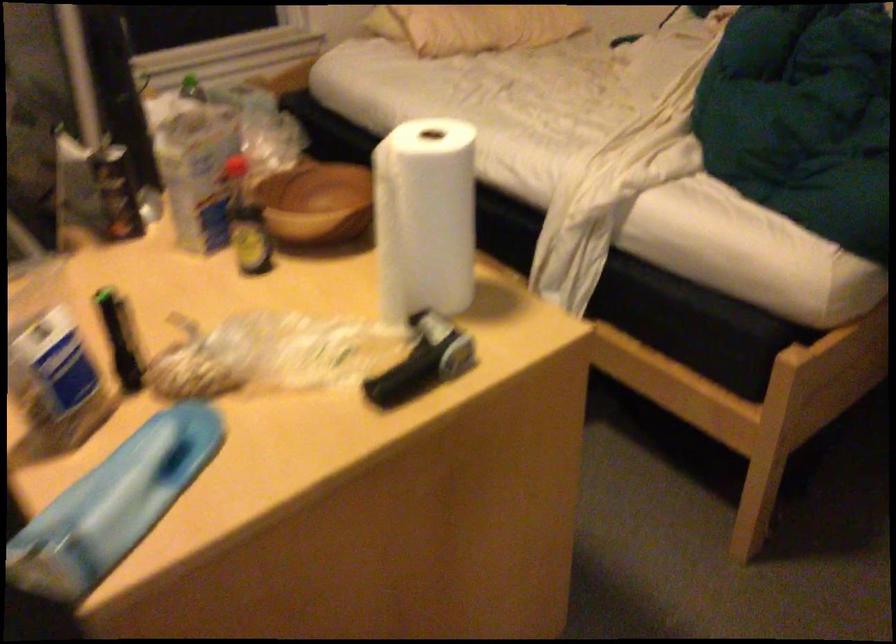
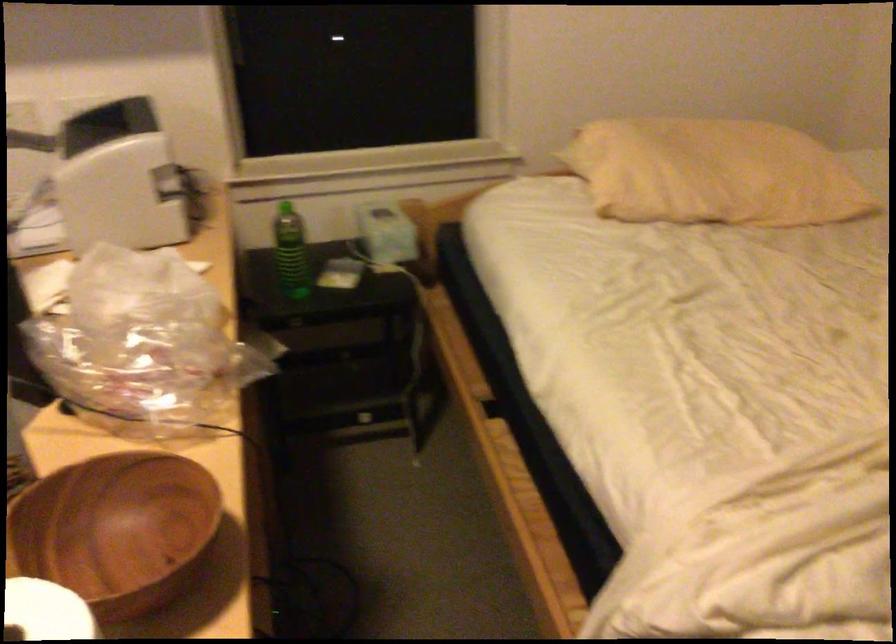
Question: The camera is either moving clockwise (left) or counter-clockwise (right) around the object. The first image is from the beginning of the video and the second image is from the end. Is the camera moving left or right when shooting the video?

Choices:
 (A) Left
 (B) Right

Answer: (B)